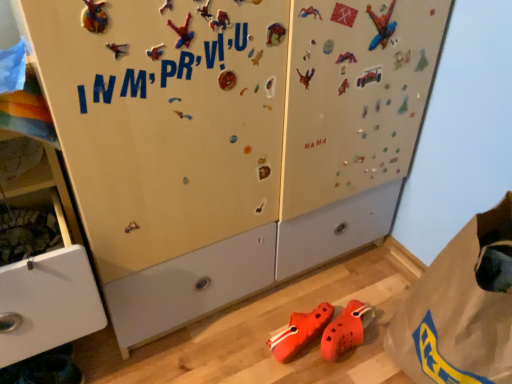
What do you see at coordinates (346, 330) in the screenshot? The height and width of the screenshot is (384, 512). I see `orange rubber clogs at lower center` at bounding box center [346, 330].

The width and height of the screenshot is (512, 384). What do you see at coordinates (461, 308) in the screenshot?
I see `brown paper bag at lower right` at bounding box center [461, 308].

I want to click on orange rubber clogs at lower center, so click(x=346, y=330).

The width and height of the screenshot is (512, 384). There is a orange rubber clogs at lower center. Identify the location of cabinetry above it (from a real-world perspective). (41, 258).

Is matte white cabinet at left positioned beyond the bounds of orange rubber clogs at lower center?

Yes.

Is matte white cabinet at left bigger or smaller than orange rubber clogs at lower center?

Clearly, matte white cabinet at left is larger in size than orange rubber clogs at lower center.

From a real-world perspective, who is located lower, matte white cabinet at left or orange rubber clogs at lower center?

From a 3D spatial view, orange rubber clogs at lower center is below.

From the image's perspective, between brown paper bag at lower right and matte white cabinet at left, who is located below?

From the image's view, brown paper bag at lower right is below.

Does brown paper bag at lower right have a lesser height compared to matte white cabinet at left?

Indeed, brown paper bag at lower right has a lesser height compared to matte white cabinet at left.

Consider the image. Can we say brown paper bag at lower right lies outside matte white cabinet at left?

That's correct, brown paper bag at lower right is outside of matte white cabinet at left.

This screenshot has height=384, width=512. In order to click on paper bag below the matte white cabinet at left (from a real-world perspective) in this screenshot , I will do `click(461, 308)`.

Is brown paper bag at lower right placed right next to orange rubber clogs at lower center?

No.

Considering the relative sizes of brown paper bag at lower right and orange rubber clogs at lower center in the image provided, is brown paper bag at lower right smaller than orange rubber clogs at lower center?

No, brown paper bag at lower right is not smaller than orange rubber clogs at lower center.

How distant is brown paper bag at lower right from orange rubber clogs at lower center?

A distance of 11.42 inches exists between brown paper bag at lower right and orange rubber clogs at lower center.

Between brown paper bag at lower right and orange rubber clogs at lower center, which one has less height?

With less height is orange rubber clogs at lower center.

Which is in front, point (333, 357) or point (475, 332)?

Positioned in front is point (475, 332).

From the image's perspective, is orange rubber clogs at lower center beneath brown paper bag at lower right?

Yes, from the image's perspective, orange rubber clogs at lower center is beneath brown paper bag at lower right.

Measure the distance from orange rubber clogs at lower center to brown paper bag at lower right.

orange rubber clogs at lower center is 11.42 inches from brown paper bag at lower right.

Considering the relative sizes of orange rubber clogs at lower center and brown paper bag at lower right in the image provided, is orange rubber clogs at lower center bigger than brown paper bag at lower right?

Incorrect, orange rubber clogs at lower center is not larger than brown paper bag at lower right.

Could you tell me if orange rubber clogs at lower center is facing matte white cabinet at left?

No, orange rubber clogs at lower center is not turned towards matte white cabinet at left.

Looking at this image, can you tell me how much orange rubber clogs at lower center and matte white cabinet at left differ in facing direction?

63.7 degrees.

Which is less distant, (323, 348) or (96, 331)?

The point (323, 348) is closer to the camera.

Considering the relative sizes of orange rubber clogs at lower center and matte white cabinet at left in the image provided, is orange rubber clogs at lower center shorter than matte white cabinet at left?

Yes.

Between matte white cabinet at left and brown paper bag at lower right, which one has smaller size?

With smaller size is brown paper bag at lower right.

Which is behind, matte white cabinet at left or brown paper bag at lower right?

brown paper bag at lower right is further away from the camera.

I want to click on paper bag below the matte white cabinet at left (from the image's perspective), so click(x=461, y=308).

From a real-world perspective, is matte white cabinet at left above or below brown paper bag at lower right?

Clearly, from a real-world perspective, matte white cabinet at left is above brown paper bag at lower right.

I want to click on footwear located on the right of matte white cabinet at left, so click(346, 330).

Locate an element on the screen. The width and height of the screenshot is (512, 384). cabinetry above the brown paper bag at lower right (from a real-world perspective) is located at coordinates (41, 258).

Based on their spatial positions, is orange rubber clogs at lower center or brown paper bag at lower right closer to matte white cabinet at left?

orange rubber clogs at lower center is positioned closer to the anchor matte white cabinet at left.

Looking at the image, which one is located further to matte white cabinet at left, brown paper bag at lower right or orange rubber clogs at lower center?

brown paper bag at lower right.

Based on their spatial positions, is matte white cabinet at left or brown paper bag at lower right closer to orange rubber clogs at lower center?

brown paper bag at lower right lies closer to orange rubber clogs at lower center than the other object.

Considering their positions, is orange rubber clogs at lower center positioned closer to brown paper bag at lower right than matte white cabinet at left?

orange rubber clogs at lower center is closer to brown paper bag at lower right.

From the image, which object appears to be nearer to brown paper bag at lower right, matte white cabinet at left or orange rubber clogs at lower center?

Based on the image, orange rubber clogs at lower center appears to be nearer to brown paper bag at lower right.

Considering their positions, is brown paper bag at lower right positioned closer to orange rubber clogs at lower center than matte white cabinet at left?

brown paper bag at lower right is positioned closer to the anchor orange rubber clogs at lower center.

The width and height of the screenshot is (512, 384). I want to click on footwear between matte white cabinet at left and brown paper bag at lower right in the horizontal direction, so [346, 330].